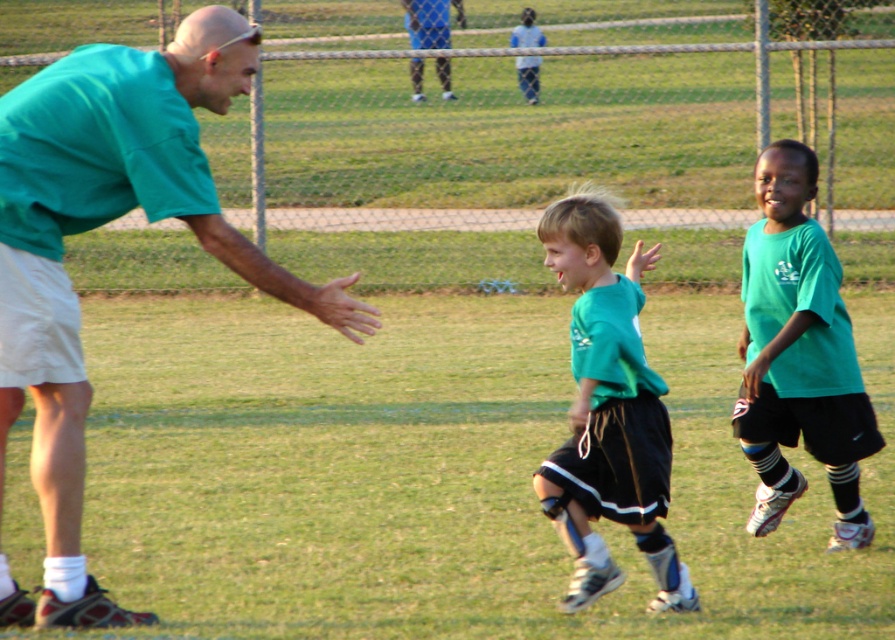
Who is higher up, green matte shirt at right or blue jersey at upper center?

blue jersey at upper center is higher up.

Is point (776, 524) farther from camera compared to point (525, 72)?

No, it is not.

Identify the location of green matte shirt at right. (798, 353).

Does green matte shirt at center have a greater width compared to blue jersey at upper center?

Yes, green matte shirt at center is wider than blue jersey at upper center.

Describe the element at coordinates (607, 410) in the screenshot. I see `green matte shirt at center` at that location.

At what (x,y) coordinates should I click in order to perform the action: click on green matte shirt at center. Please return your answer as a coordinate pair (x, y). Looking at the image, I should click on (607, 410).

Does green matte shirt at center appear under green matte shirt at right?

Yes, green matte shirt at center is below green matte shirt at right.

Which is behind, point (620, 298) or point (849, 332)?

The point (849, 332) is behind.

This screenshot has height=640, width=895. What do you see at coordinates (607, 410) in the screenshot? I see `green matte shirt at center` at bounding box center [607, 410].

The height and width of the screenshot is (640, 895). Find the location of `green matte shirt at center`. green matte shirt at center is located at coordinates (607, 410).